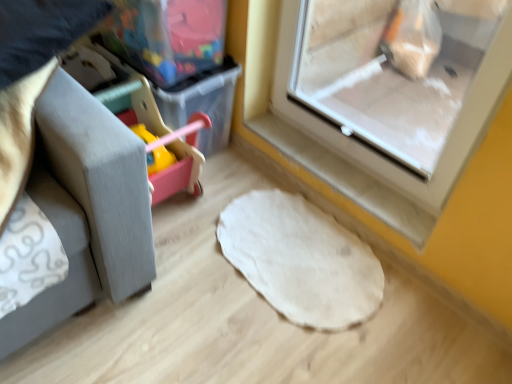
Question: Is white felt mat at center in front of or behind transparent plastic screen door at upper right in the image?

Choices:
 (A) behind
 (B) front

Answer: (A)

Question: Is white felt mat at center spatially inside transparent plastic screen door at upper right, or outside of it?

Choices:
 (A) inside
 (B) outside

Answer: (B)

Question: Estimate the real-world distances between objects in this image. Which object is farther from the transparent plastic screen door at upper right?

Choices:
 (A) white felt mat at center
 (B) translucent plastic storage box at upper left

Answer: (B)

Question: Which of these objects is positioned farthest from the transparent plastic screen door at upper right?

Choices:
 (A) white felt mat at center
 (B) translucent plastic storage box at upper left

Answer: (B)